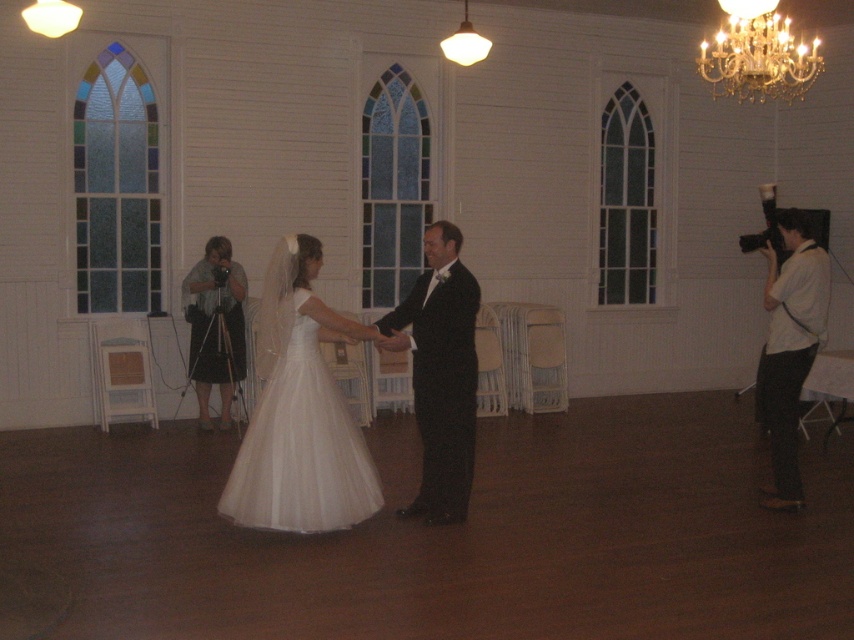
Between white shirt at right and gold crystal chandelier at upper right, which one has more height?

white shirt at right is taller.

Does white shirt at right lie in front of gold crystal chandelier at upper right?

Yes, it is in front of gold crystal chandelier at upper right.

Where is `white shirt at right`? The image size is (854, 640). white shirt at right is located at coordinates (790, 346).

In order to click on white shirt at right in this screenshot , I will do `click(790, 346)`.

Can you confirm if white satin dress at center is positioned to the right of white shirt at right?

Incorrect, white satin dress at center is not on the right side of white shirt at right.

Is point (314, 262) less distant than point (778, 420)?

Yes.

This screenshot has height=640, width=854. Identify the location of white satin dress at center. pyautogui.click(x=301, y=412).

Which is behind, point (317, 339) or point (785, 83)?

The point (785, 83) is more distant.

In the scene shown: Can you confirm if white satin dress at center is smaller than gold crystal chandelier at upper right?

No, white satin dress at center is not smaller than gold crystal chandelier at upper right.

Is point (358, 452) closer to viewer compared to point (774, 67)?

Yes, point (358, 452) is closer to viewer.

The image size is (854, 640). I want to click on white satin dress at center, so click(x=301, y=412).